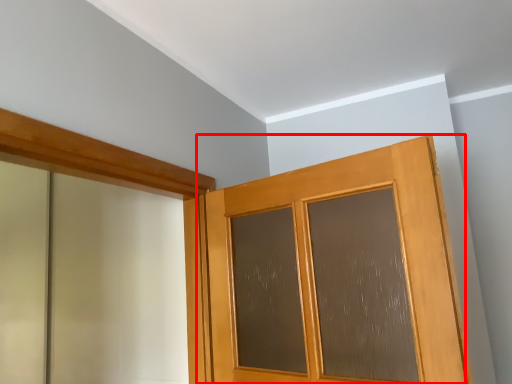
Question: From the image's perspective, what is the correct spatial positioning of door (annotated by the red box) in reference to barn door?

Choices:
 (A) below
 (B) above

Answer: (A)